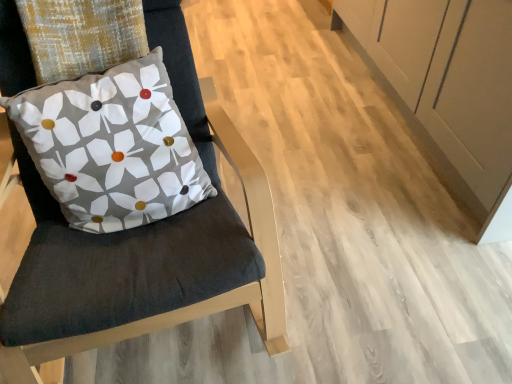
Question: Does velvet cushion at left have a greater height compared to matte fabric pillow at left?

Choices:
 (A) yes
 (B) no

Answer: (A)

Question: Could you tell me if velvet cushion at left is turned towards matte fabric pillow at left?

Choices:
 (A) no
 (B) yes

Answer: (B)

Question: Is matte fabric pillow at left completely or partially inside velvet cushion at left?

Choices:
 (A) yes
 (B) no

Answer: (A)

Question: From a real-world perspective, is velvet cushion at left located higher than matte fabric pillow at left?

Choices:
 (A) no
 (B) yes

Answer: (A)

Question: Can you confirm if velvet cushion at left is shorter than matte fabric pillow at left?

Choices:
 (A) no
 (B) yes

Answer: (A)

Question: Considering the relative positions of velvet cushion at left and matte fabric pillow at left in the image provided, is velvet cushion at left to the left of matte fabric pillow at left from the viewer's perspective?

Choices:
 (A) yes
 (B) no

Answer: (B)

Question: From a real-world perspective, is matte fabric pillow at left physically below velvet cushion at left?

Choices:
 (A) yes
 (B) no

Answer: (B)

Question: Does matte fabric pillow at left lie behind velvet cushion at left?

Choices:
 (A) no
 (B) yes

Answer: (B)

Question: Does matte fabric pillow at left have a lesser height compared to velvet cushion at left?

Choices:
 (A) yes
 (B) no

Answer: (A)

Question: Can you confirm if matte fabric pillow at left is thinner than velvet cushion at left?

Choices:
 (A) yes
 (B) no

Answer: (A)

Question: Could you tell me if matte fabric pillow at left is facing velvet cushion at left?

Choices:
 (A) yes
 (B) no

Answer: (A)

Question: Is matte fabric pillow at left directly adjacent to velvet cushion at left?

Choices:
 (A) yes
 (B) no

Answer: (B)

Question: Is matte fabric pillow at left situated inside velvet cushion at left or outside?

Choices:
 (A) outside
 (B) inside

Answer: (B)